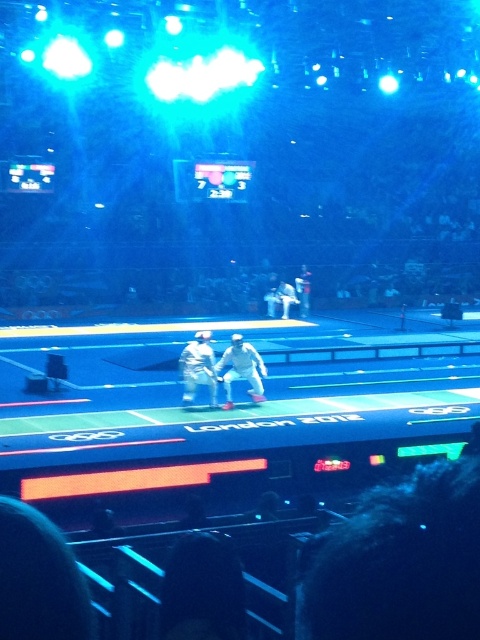
You are a photographer at the London 2012 Olympics. You need to capture a photo of the white fabric tennis racket at center and the camouflage fabric uniform at center. Which object should you focus on to ensure the other remains in the background?

The white fabric tennis racket at center is positioned under camouflage fabric uniform at center, so focusing on the camouflage fabric uniform at center will keep the white fabric tennis racket at center in the background.

You are a photographer at the London 2012 Olympics. You need to position your camera to capture the white fabric tennis racket at center. According to the arena layout, the camera must be placed at coordinates between 0.4 and 0.6 on the x and y axes. Can you position the camera within the required area?

The white fabric tennis racket at center is located at point (241, 369). Since both coordinates are between 0.4 and 0.6, the camera can be positioned within the required area.

You are a photographer at the London 2012 Olympics. You need to capture a closeup of the point at coordinates (241, 369). Where should you aim your camera to capture this point?

The point at coordinates (241, 369) is located on the white fabric tennis racket at center. Aim your camera at the white fabric tennis racket at center to capture this point.